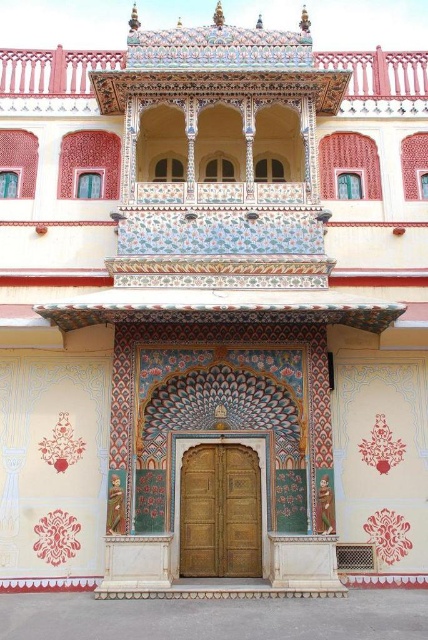
Who is shorter, polychrome painted balcony at upper center or golden wood door at center?

golden wood door at center is shorter.

Does point (14, 65) come closer to viewer compared to point (259, 497)?

No, (14, 65) is behind (259, 497).

Between point (17, 77) and point (181, 516), which one is positioned in front?

Point (181, 516)

This screenshot has width=428, height=640. In order to click on polychrome painted balcony at upper center in this screenshot , I will do `click(51, 77)`.